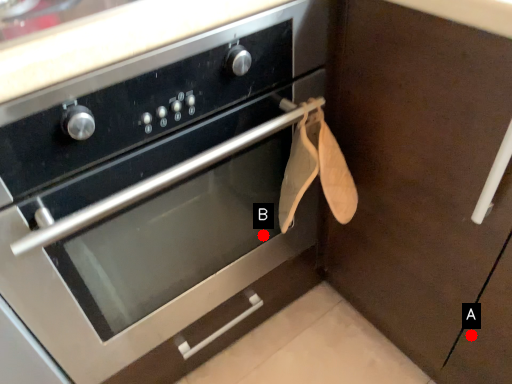
Question: Two points are circled on the image, labeled by A and B beside each circle. Which point is further to the camera?

Choices:
 (A) A is further
 (B) B is further

Answer: (B)